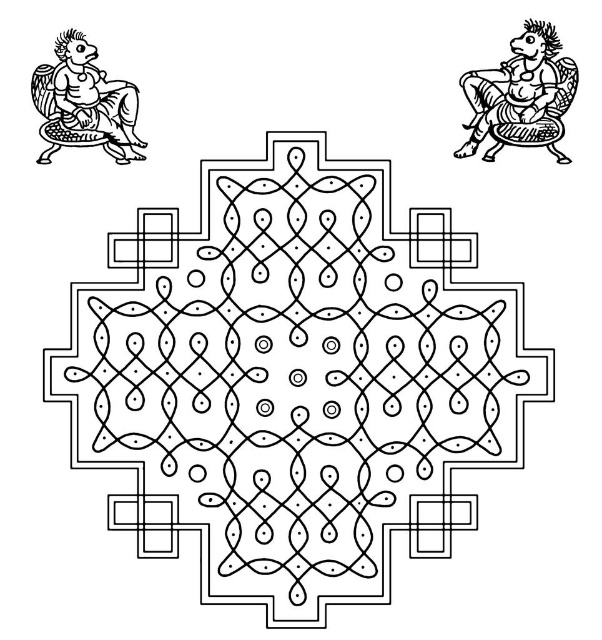
Question: Can you confirm if black line art mandala at center is wider than black line art figure at upper right?

Choices:
 (A) yes
 (B) no

Answer: (A)

Question: Which of the following is the closest to the observer?

Choices:
 (A) (340, 192)
 (B) (61, 74)
 (C) (515, 44)

Answer: (B)

Question: Which point appears closest to the camera in this image?

Choices:
 (A) (111, 88)
 (B) (515, 45)

Answer: (A)

Question: Which of the following is the closest to the observer?

Choices:
 (A) black ink figure at upper left
 (B) black line art figure at upper right
 (C) black line art mandala at center

Answer: (C)

Question: Does black line art mandala at center appear on the right side of black line art figure at upper right?

Choices:
 (A) yes
 (B) no

Answer: (B)

Question: Is black line art mandala at center bigger than black ink figure at upper left?

Choices:
 (A) yes
 (B) no

Answer: (A)